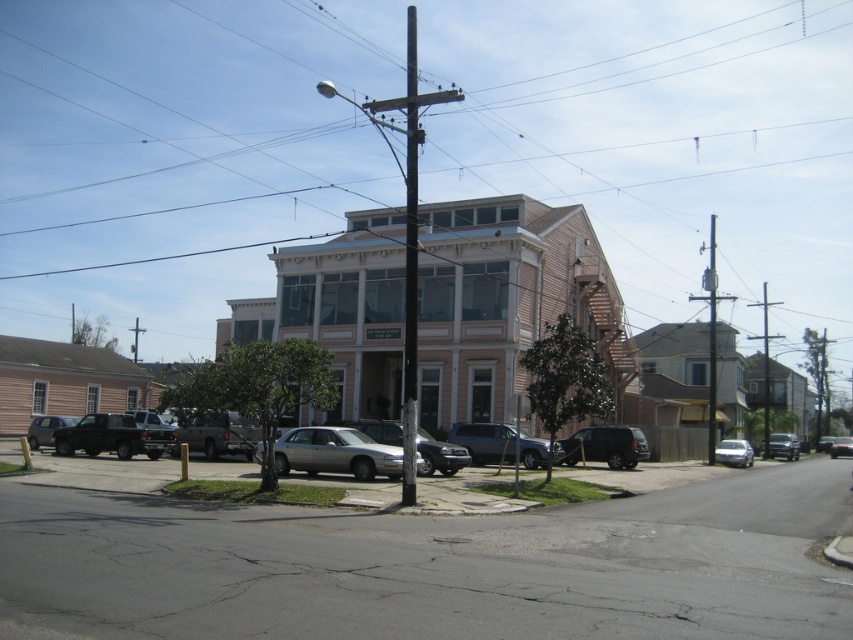
This screenshot has height=640, width=853. I want to click on black metal/wooden pole at center, so click(x=410, y=241).

Who is lower down, black metal/wooden pole at center or silver metallic sedan at center?

Positioned lower is silver metallic sedan at center.

Is point (415, 152) more distant than point (317, 468)?

No, it is not.

This screenshot has height=640, width=853. What are the coordinates of `black metal/wooden pole at center` in the screenshot? It's located at (410, 241).

This screenshot has width=853, height=640. Describe the element at coordinates (410, 241) in the screenshot. I see `black metal/wooden pole at center` at that location.

Is black metal/wooden pole at center positioned at the back of matte silver sedan at left?

That is False.

Identify the location of black metal/wooden pole at center. This screenshot has width=853, height=640. (410, 241).

Between black metallic pole at center and satin black sedan at center-right, which one appears on the left side from the viewer's perspective?

black metallic pole at center

Does black metallic pole at center have a larger size compared to satin black sedan at center-right?

Indeed, black metallic pole at center has a larger size compared to satin black sedan at center-right.

Describe the element at coordinates (410, 268) in the screenshot. The height and width of the screenshot is (640, 853). I see `black metallic pole at center` at that location.

Where is `black metallic pole at center`? black metallic pole at center is located at coordinates (410, 268).